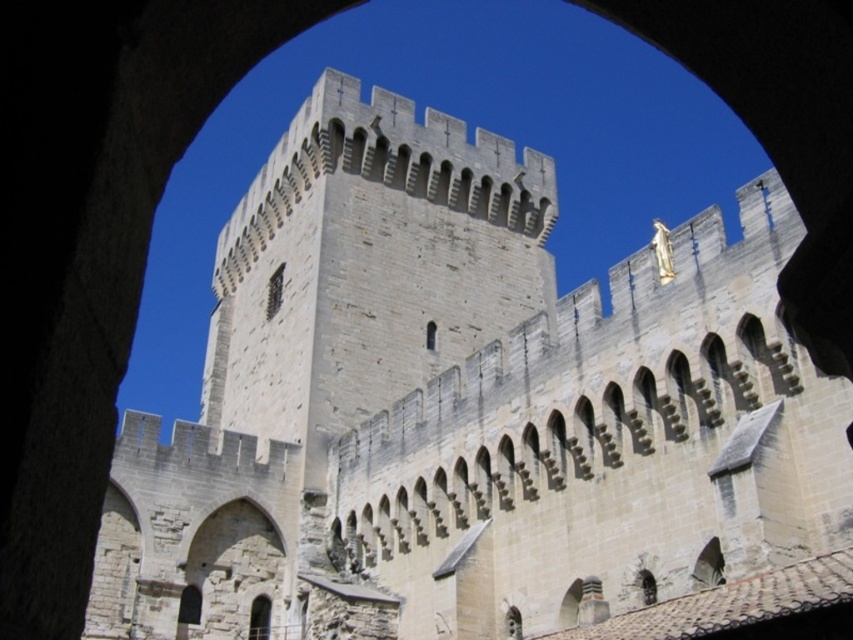
Based on the photo, is matte stone window at center bigger than smooth stone window at center?

Yes.

Can you confirm if matte stone window at center is taller than smooth stone window at center?

Indeed, matte stone window at center has a greater height compared to smooth stone window at center.

Measure the distance between point (281, 300) and camera.

Point (281, 300) is 267.22 feet away from camera.

Where is `matte stone window at center`? Image resolution: width=853 pixels, height=640 pixels. matte stone window at center is located at coordinates (274, 291).

Does matte stone window at lower left have a lesser width compared to smooth stone window at center?

No.

Image resolution: width=853 pixels, height=640 pixels. Describe the element at coordinates (189, 605) in the screenshot. I see `matte stone window at lower left` at that location.

At what (x,y) coordinates should I click in order to perform the action: click on matte stone window at lower left. Please return your answer as a coordinate pair (x, y). The height and width of the screenshot is (640, 853). Looking at the image, I should click on (189, 605).

Does stone window at lower left have a lesser height compared to smooth stone window at center?

Incorrect, stone window at lower left's height does not fall short of smooth stone window at center's.

Who is more distant from viewer, (254, 596) or (425, 326)?

Positioned behind is point (425, 326).

The image size is (853, 640). What are the coordinates of `stone window at lower left` in the screenshot? It's located at (259, 618).